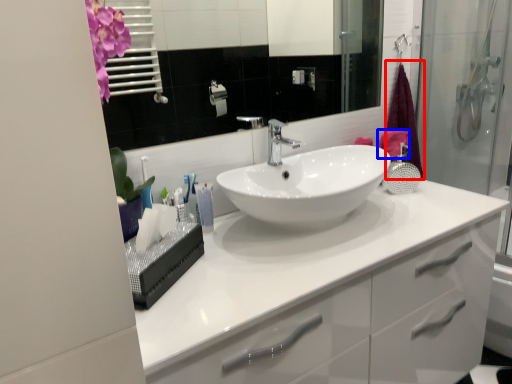
Question: Among these objects, which one is nearest to the camera, shower curtain (highlighted by a red box) or bath towel (highlighted by a blue box)?

Choices:
 (A) shower curtain
 (B) bath towel

Answer: (B)